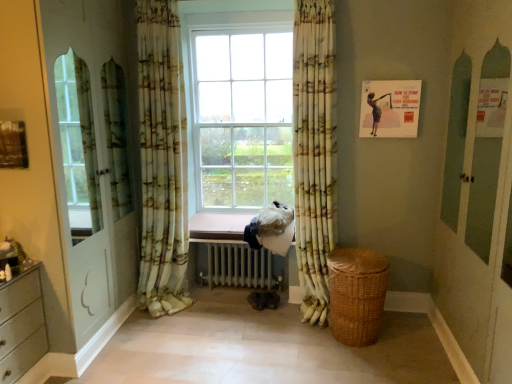
You are a GUI agent. You are given a task and a screenshot of the screen. Output one action in this format:
    pyautogui.click(x=<x>, y=<y>)
    Task: Click on the free point in front of printed fabric curtain at left, the second curtain when ordered from right to left
    This screenshot has height=384, width=512.
    Given the screenshot: What is the action you would take?
    pyautogui.click(x=157, y=336)